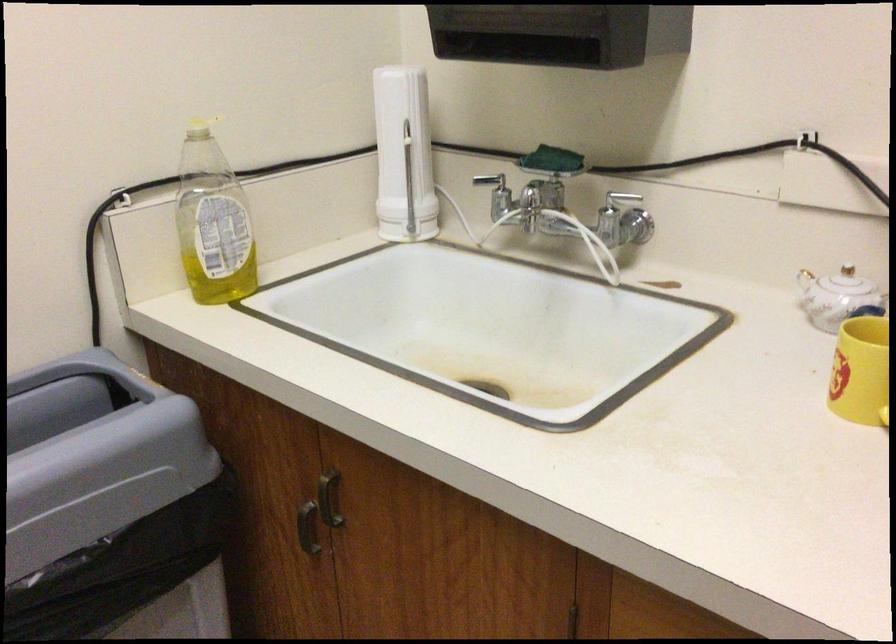
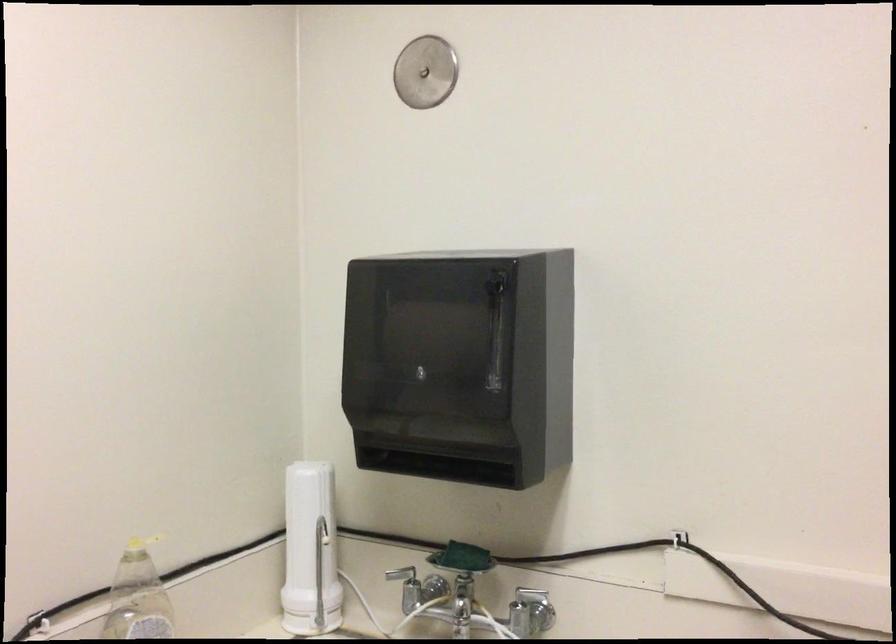
In a continuous first-person perspective shot, in which direction is the camera moving?

The cameraman moved toward left, backward.